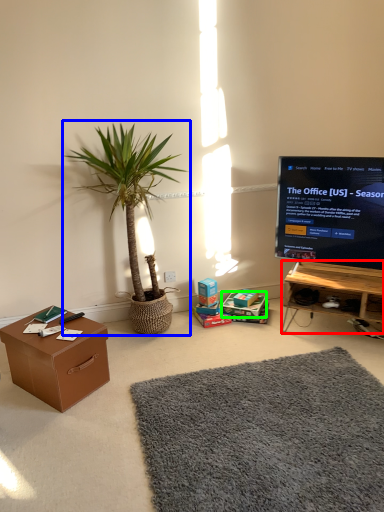
Question: Considering the real-world distances, which object is closest to desk (highlighted by a red box)? houseplant (highlighted by a blue box) or cardboard box (highlighted by a green box).

Choices:
 (A) houseplant
 (B) cardboard box

Answer: (B)